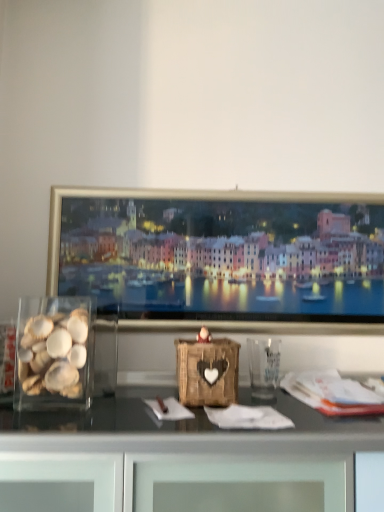
What do you see at coordinates (54, 353) in the screenshot? The width and height of the screenshot is (384, 512). I see `translucent glass shells at left` at bounding box center [54, 353].

Identify the location of translucent glass shells at left. This screenshot has width=384, height=512. (54, 353).

Image resolution: width=384 pixels, height=512 pixels. What do you see at coordinates (263, 367) in the screenshot?
I see `transparent plastic glass at center` at bounding box center [263, 367].

Measure the distance between transparent plastic glass at center and camera.

The distance of transparent plastic glass at center from camera is 38.99 inches.

Where is `transparent plastic glass at center`? transparent plastic glass at center is located at coordinates (263, 367).

Image resolution: width=384 pixels, height=512 pixels. What are the coordinates of `translucent glass shells at left` in the screenshot? It's located at (54, 353).

Does translucent glass shells at left appear on the right side of transparent plastic glass at center?

In fact, translucent glass shells at left is to the left of transparent plastic glass at center.

Is translucent glass shells at left in front of or behind transparent plastic glass at center in the image?

translucent glass shells at left is positioned closer to the viewer than transparent plastic glass at center.

Considering the positions of points (28, 328) and (265, 382), is point (28, 328) closer to camera compared to point (265, 382)?

Yes, it is.

From the image's perspective, is translucent glass shells at left located above or below transparent plastic glass at center?

From the image's perspective, translucent glass shells at left appears above transparent plastic glass at center.

From a real-world perspective, is translucent glass shells at left positioned over transparent plastic glass at center based on gravity?

Yes, from a real-world perspective, translucent glass shells at left is on top of transparent plastic glass at center.

Between translucent glass shells at left and transparent plastic glass at center, which one has larger width?

translucent glass shells at left is wider.

Is translucent glass shells at left taller or shorter than transparent plastic glass at center?

In the image, translucent glass shells at left appears to be taller than transparent plastic glass at center.

Does translucent glass shells at left have a larger size compared to transparent plastic glass at center?

Correct, translucent glass shells at left is larger in size than transparent plastic glass at center.

Would you say translucent glass shells at left is inside or outside transparent plastic glass at center?

The correct answer is: outside.

Are translucent glass shells at left and transparent plastic glass at center located far from each other?

No.

Is translucent glass shells at left facing away from transparent plastic glass at center?

No, translucent glass shells at left is not facing away from transparent plastic glass at center.

How much distance is there between translucent glass shells at left and transparent plastic glass at center?

translucent glass shells at left and transparent plastic glass at center are 43.71 centimeters apart.

In order to click on food above the transparent plastic glass at center (from a real-world perspective) in this screenshot , I will do `click(54, 353)`.

Can you confirm if transparent plastic glass at center is positioned to the left of translucent glass shells at left?

No, transparent plastic glass at center is not to the left of translucent glass shells at left.

Based on the photo, who is more distant, transparent plastic glass at center or translucent glass shells at left?

transparent plastic glass at center is more distant.

Does point (250, 374) appear closer or farther from the camera than point (34, 393)?

Point (250, 374) appears to be farther away from the viewer than point (34, 393).

From the image's perspective, is transparent plastic glass at center on top of translucent glass shells at left?

No, from the image's perspective, transparent plastic glass at center is not on top of translucent glass shells at left.

From a real-world perspective, is transparent plastic glass at center beneath translucent glass shells at left?

Correct, in the physical world, transparent plastic glass at center is lower than translucent glass shells at left.

Which object is thinner, transparent plastic glass at center or translucent glass shells at left?

transparent plastic glass at center.

Considering the sizes of transparent plastic glass at center and translucent glass shells at left in the image, is transparent plastic glass at center taller or shorter than translucent glass shells at left?

In the image, transparent plastic glass at center appears to be shorter than translucent glass shells at left.

Between transparent plastic glass at center and translucent glass shells at left, which one has larger size?

Bigger between the two is translucent glass shells at left.

Can we say transparent plastic glass at center lies outside translucent glass shells at left?

Yes.

Is transparent plastic glass at center in contact with translucent glass shells at left?

There is a gap between transparent plastic glass at center and translucent glass shells at left.

Is transparent plastic glass at center looking in the opposite direction of translucent glass shells at left?

transparent plastic glass at center does not have its back to translucent glass shells at left.

How many degrees apart are the facing directions of transparent plastic glass at center and translucent glass shells at left?

transparent plastic glass at center and translucent glass shells at left are facing 1.15 degrees away from each other.

The image size is (384, 512). What are the coordinates of `glass vase below the translucent glass shells at left (from the image's perspective)` in the screenshot? It's located at (263, 367).

Where is `food that is on the left side of transparent plastic glass at center`? food that is on the left side of transparent plastic glass at center is located at coordinates click(54, 353).

The height and width of the screenshot is (512, 384). Identify the location of glass vase on the right of the translucent glass shells at left. tap(263, 367).